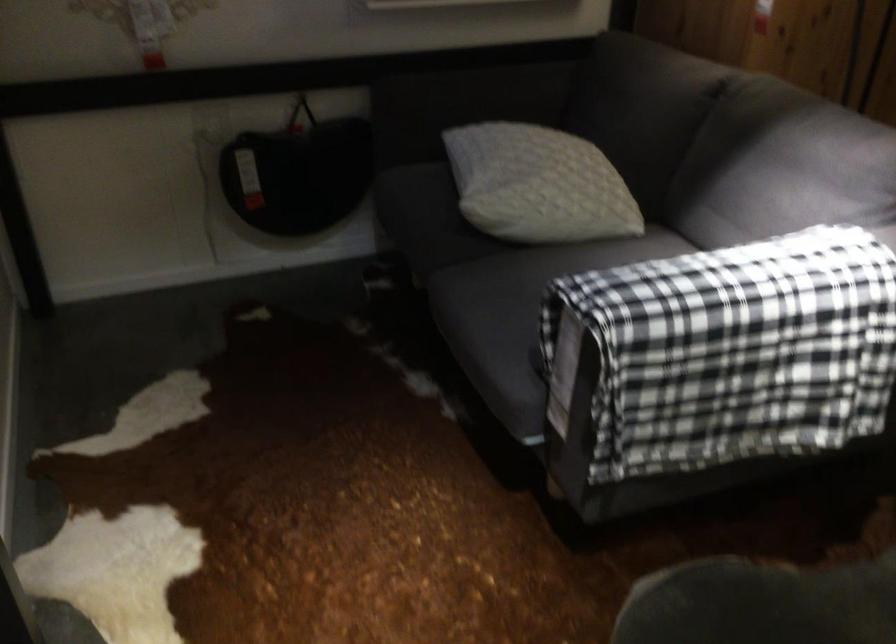
Where would you lean the sofa armrest? Please return your answer as a coordinate pair (x, y).

(478, 98)